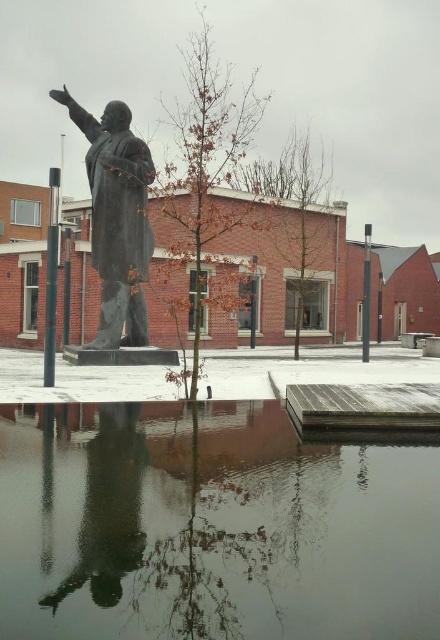
Question: Considering the relative positions of smooth reflective water at center and black polished pole at center in the image provided, where is smooth reflective water at center located with respect to black polished pole at center?

Choices:
 (A) below
 (B) above

Answer: (A)

Question: Which point appears closest to the camera in this image?

Choices:
 (A) (365, 326)
 (B) (292, 621)
 (C) (116, 296)

Answer: (B)

Question: Is smooth reflective water at center in front of black polished pole at center?

Choices:
 (A) no
 (B) yes

Answer: (B)

Question: Which point is closer to the camera?

Choices:
 (A) tap(54, 172)
 (B) tap(238, 499)
 (C) tap(370, 230)

Answer: (B)

Question: Based on their relative distances, which object is farther from the bronze statue at center?

Choices:
 (A) black metal pole at right
 (B) black polished pole at center

Answer: (A)

Question: Does bronze statue at center have a greater width compared to black metal pole at right?

Choices:
 (A) yes
 (B) no

Answer: (B)